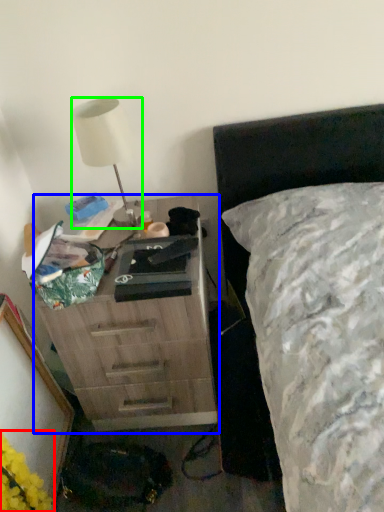
Question: Based on their relative distances, which object is nearer to flower (highlighted by a red box)? Choose from chest of drawers (highlighted by a blue box) and lamp (highlighted by a green box).

Choices:
 (A) chest of drawers
 (B) lamp

Answer: (A)